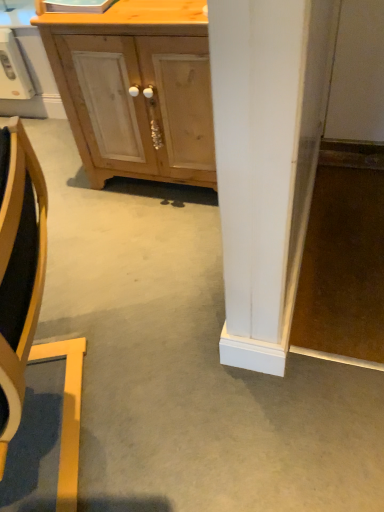
Question: Is white plastic microwave at upper left to the left of light wood cabinet at center from the viewer's perspective?

Choices:
 (A) no
 (B) yes

Answer: (B)

Question: Is white plastic microwave at upper left at the right side of light wood cabinet at center?

Choices:
 (A) yes
 (B) no

Answer: (B)

Question: Can you confirm if white plastic microwave at upper left is taller than light wood cabinet at center?

Choices:
 (A) no
 (B) yes

Answer: (A)

Question: Considering the relative positions of white plastic microwave at upper left and light wood cabinet at center in the image provided, is white plastic microwave at upper left in front of light wood cabinet at center?

Choices:
 (A) no
 (B) yes

Answer: (A)

Question: Would you say white plastic microwave at upper left contains light wood cabinet at center?

Choices:
 (A) yes
 (B) no

Answer: (B)

Question: Considering the relative sizes of white plastic microwave at upper left and light wood cabinet at center in the image provided, is white plastic microwave at upper left thinner than light wood cabinet at center?

Choices:
 (A) yes
 (B) no

Answer: (A)

Question: Considering the relative sizes of white plastic microwave at upper left and wooden chair at left in the image provided, is white plastic microwave at upper left thinner than wooden chair at left?

Choices:
 (A) no
 (B) yes

Answer: (B)

Question: From the image's perspective, would you say white plastic microwave at upper left is shown under wooden chair at left?

Choices:
 (A) no
 (B) yes

Answer: (A)

Question: Is white plastic microwave at upper left looking in the opposite direction of wooden chair at left?

Choices:
 (A) no
 (B) yes

Answer: (A)

Question: Does white plastic microwave at upper left have a greater width compared to wooden chair at left?

Choices:
 (A) no
 (B) yes

Answer: (A)

Question: Considering the relative sizes of white plastic microwave at upper left and wooden chair at left in the image provided, is white plastic microwave at upper left bigger than wooden chair at left?

Choices:
 (A) yes
 (B) no

Answer: (B)

Question: Can wooden chair at left be found inside white plastic microwave at upper left?

Choices:
 (A) yes
 (B) no

Answer: (B)

Question: Is the depth of wooden chair at left less than that of light wood cabinet at center?

Choices:
 (A) yes
 (B) no

Answer: (A)